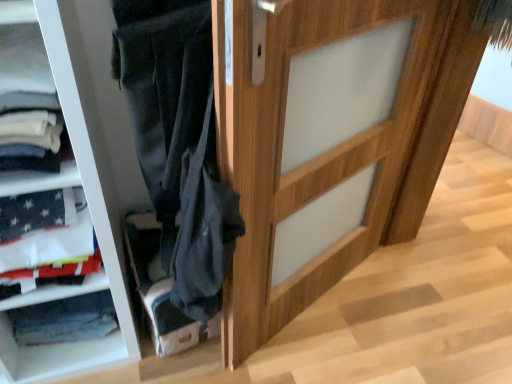
Identify the location of velvet dark blue pants at lower center. (161, 290).

Describe the element at coordinates (161, 290) in the screenshot. I see `velvet dark blue pants at lower center` at that location.

What do you see at coordinates (329, 139) in the screenshot? The height and width of the screenshot is (384, 512). I see `wooden door at center` at bounding box center [329, 139].

Where is `wooden door at center`? Image resolution: width=512 pixels, height=384 pixels. wooden door at center is located at coordinates (329, 139).

Where is `velvet dark blue pants at lower center`? velvet dark blue pants at lower center is located at coordinates (161, 290).

Is wooden door at center to the left of velvet dark blue pants at lower center from the viewer's perspective?

No, wooden door at center is not to the left of velvet dark blue pants at lower center.

Is wooden door at center in front of or behind velvet dark blue pants at lower center in the image?

wooden door at center is in front of velvet dark blue pants at lower center.

Does point (340, 61) come behind point (147, 269)?

No, (340, 61) is closer to viewer.

From the image's perspective, is wooden door at center above or below velvet dark blue pants at lower center?

wooden door at center is situated higher than velvet dark blue pants at lower center in the image.

From a real-world perspective, is wooden door at center positioned above or below velvet dark blue pants at lower center?

Clearly, from a real-world perspective, wooden door at center is above velvet dark blue pants at lower center.

Considering the sizes of objects wooden door at center and velvet dark blue pants at lower center in the image provided, who is thinner, wooden door at center or velvet dark blue pants at lower center?

wooden door at center.

Which of these two, wooden door at center or velvet dark blue pants at lower center, stands shorter?

velvet dark blue pants at lower center is shorter.

Between wooden door at center and velvet dark blue pants at lower center, which one has larger size?

wooden door at center is bigger.

In the scene shown: Is wooden door at center spatially inside velvet dark blue pants at lower center, or outside of it?

wooden door at center is not enclosed by velvet dark blue pants at lower center.

Based on the photo, is wooden door at center placed right next to velvet dark blue pants at lower center?

wooden door at center is not next to velvet dark blue pants at lower center, and they're not touching.

Is wooden door at center facing towards velvet dark blue pants at lower center?

No, wooden door at center is not aimed at velvet dark blue pants at lower center.

Locate an element on the screen. This screenshot has width=512, height=384. shelf that is under the wooden door at center (from a real-world perspective) is located at coordinates (161, 290).

Is velvet dark blue pants at lower center at the left side of wooden door at center?

Indeed, velvet dark blue pants at lower center is positioned on the left side of wooden door at center.

Is velvet dark blue pants at lower center in front of wooden door at center?

No, velvet dark blue pants at lower center is behind wooden door at center.

Is point (150, 252) farther from camera compared to point (422, 63)?

Yes, point (150, 252) is farther from viewer.

From the image's perspective, which one is positioned lower, velvet dark blue pants at lower center or wooden door at center?

velvet dark blue pants at lower center appears lower in the image.

Based on the photo, from a real-world perspective, who is located lower, velvet dark blue pants at lower center or wooden door at center?

velvet dark blue pants at lower center, from a real-world perspective.

Is velvet dark blue pants at lower center wider or thinner than wooden door at center?

Clearly, velvet dark blue pants at lower center has more width compared to wooden door at center.

Between velvet dark blue pants at lower center and wooden door at center, which one has more height?

Standing taller between the two is wooden door at center.

Considering the sizes of objects velvet dark blue pants at lower center and wooden door at center in the image provided, who is smaller, velvet dark blue pants at lower center or wooden door at center?

velvet dark blue pants at lower center.

From the picture: Does velvet dark blue pants at lower center contain wooden door at center?

Definitely not — wooden door at center is not inside velvet dark blue pants at lower center.

Is velvet dark blue pants at lower center directly adjacent to wooden door at center?

There is a gap between velvet dark blue pants at lower center and wooden door at center.

Is velvet dark blue pants at lower center facing towards wooden door at center?

No, velvet dark blue pants at lower center is not aimed at wooden door at center.

Can you tell me how much velvet dark blue pants at lower center and wooden door at center differ in facing direction?

13.1 degrees separate the facing orientations of velvet dark blue pants at lower center and wooden door at center.

Locate an element on the screen. The image size is (512, 384). shelf below the wooden door at center (from the image's perspective) is located at coordinates (161, 290).

You are a GUI agent. You are given a task and a screenshot of the screen. Output one action in this format:
    pyautogui.click(x=<x>, y=<y>)
    Task: Click on the shelf lying below the wooden door at center (from the image's perspective)
    Image resolution: width=512 pixels, height=384 pixels.
    Given the screenshot: What is the action you would take?
    click(x=161, y=290)

At what (x,y) coordinates should I click in order to perform the action: click on shelf that appears on the left of wooden door at center. Please return your answer as a coordinate pair (x, y). The width and height of the screenshot is (512, 384). Looking at the image, I should click on (161, 290).